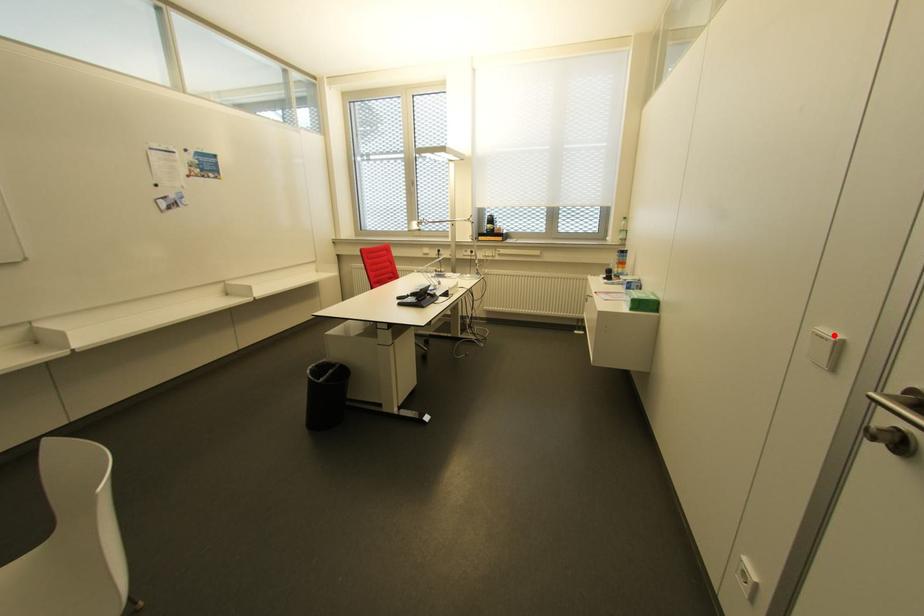
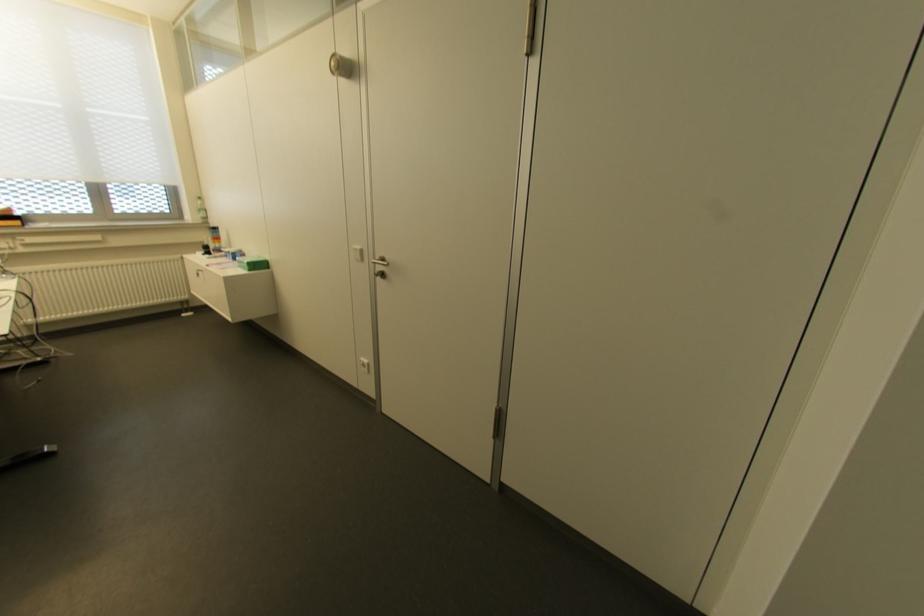
Find the pixel in the second image that matches the highlighted location in the first image.

(358, 246)